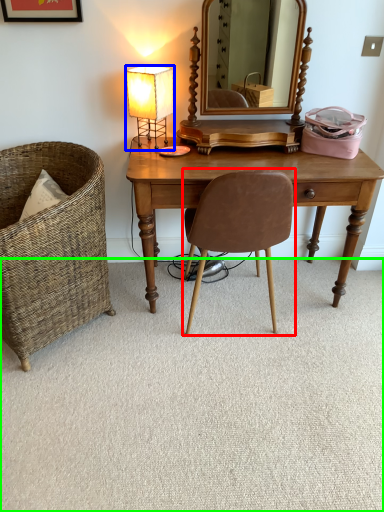
Question: Estimate the real-world distances between objects in this image. Which object is closer to chair (highlighted by a red box), lamp (highlighted by a blue box) or plain (highlighted by a green box)?

Choices:
 (A) lamp
 (B) plain

Answer: (B)